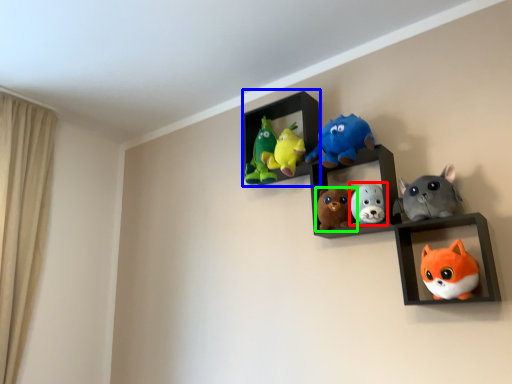
Question: Which is nearer to the toy (highlighted by a red box)? cabinet (highlighted by a blue box) or toy (highlighted by a green box).

Choices:
 (A) cabinet
 (B) toy

Answer: (B)